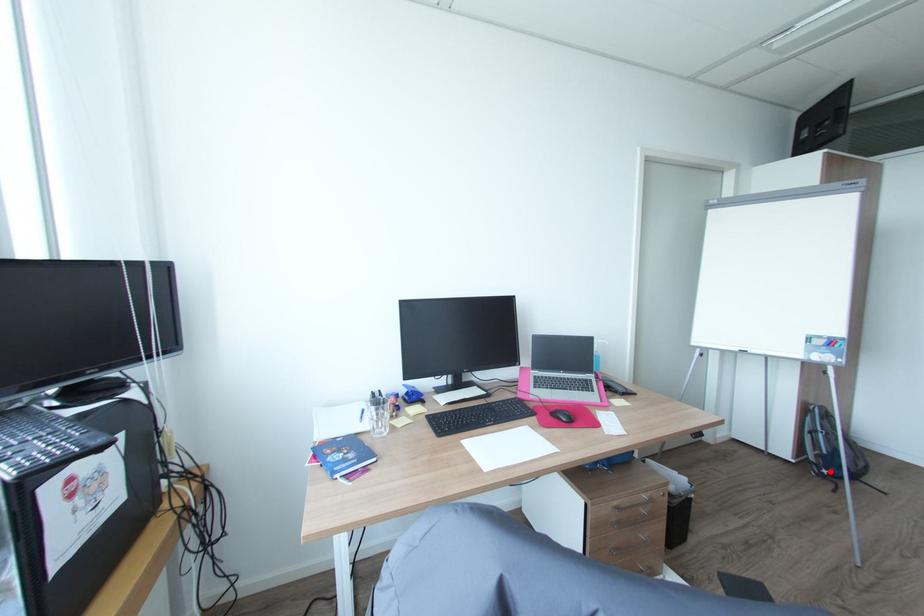
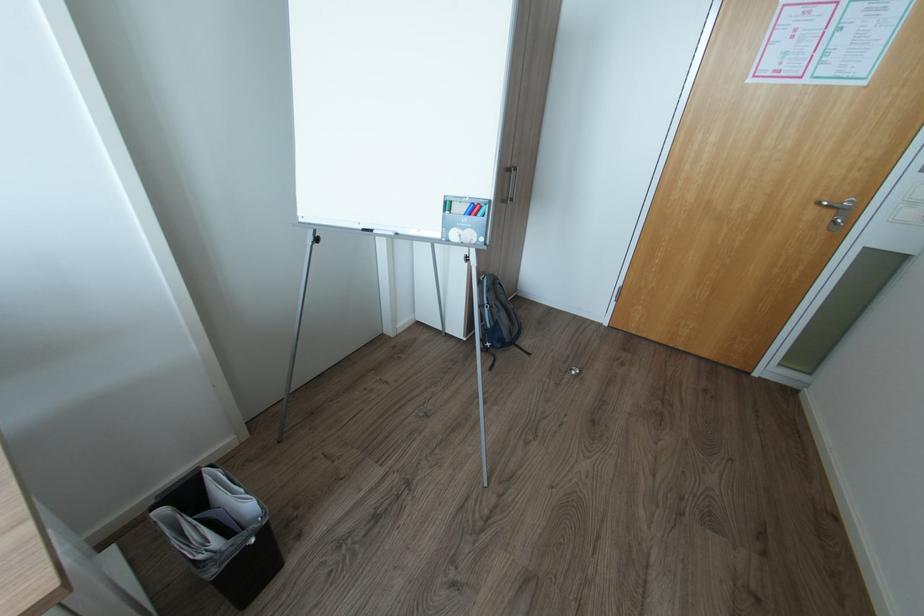
Where in the second image is the point corresponding to the highlighted location from the first image?

(492, 344)